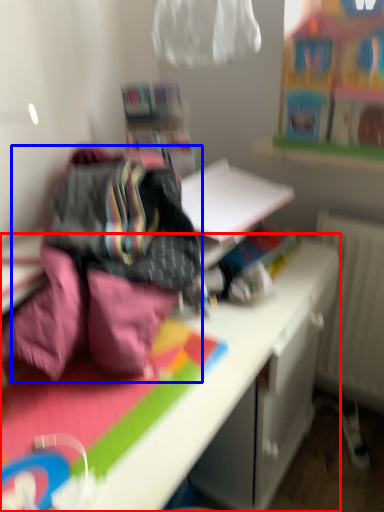
Question: Which object is further to the camera taking this photo, desk (highlighted by a red box) or bedding (highlighted by a blue box)?

Choices:
 (A) desk
 (B) bedding

Answer: (B)